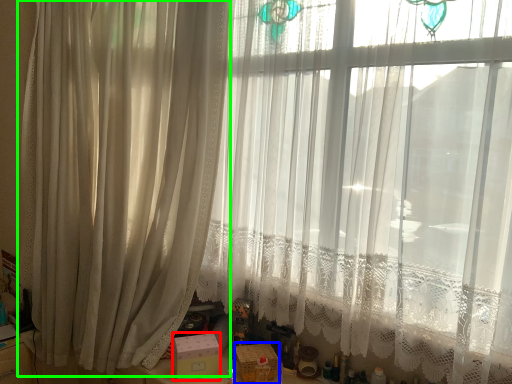
Question: Which object is the closest to the box (highlighted by a red box)? Choose among these: box (highlighted by a blue box) or curtain (highlighted by a green box).

Choices:
 (A) box
 (B) curtain

Answer: (A)